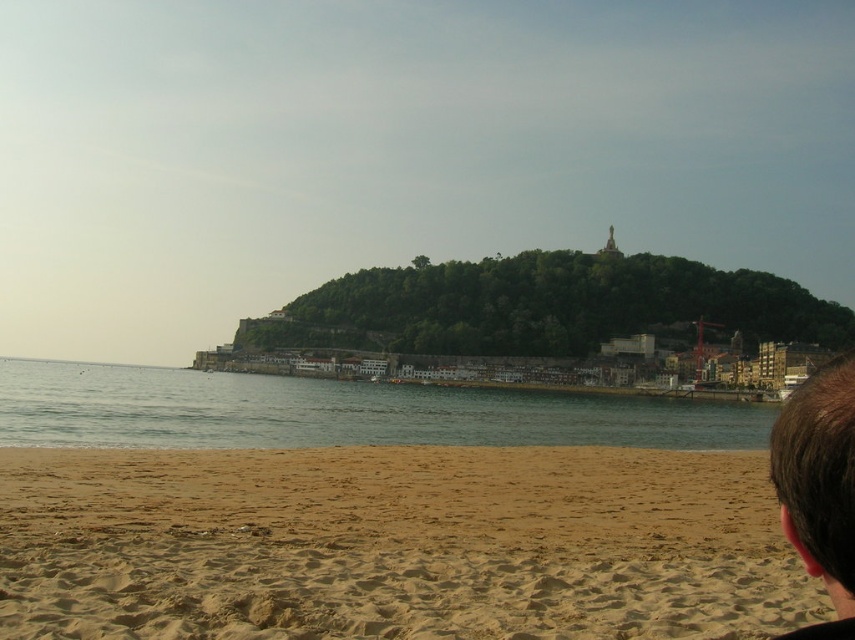
You are standing on the beach in the scene and want to take a photo of the brown hair at lower right without the clear water at lower center appearing in the frame. How should you position yourself relative to these objects?

To avoid including the clear water at lower center in your photo, position yourself so that the brown hair at lower right is above the clear water at lower center, as the clear water at lower center is below the brown hair at lower right.

You are standing on the beach and see the fine grained sand at lower left. If you walk towards the point marked by point (394, 545), will you be moving towards the water or away from it?

The point (394, 545) corresponds to the fine grained sand at lower left, which is located near the water. Therefore, walking towards this point would mean moving towards the water.